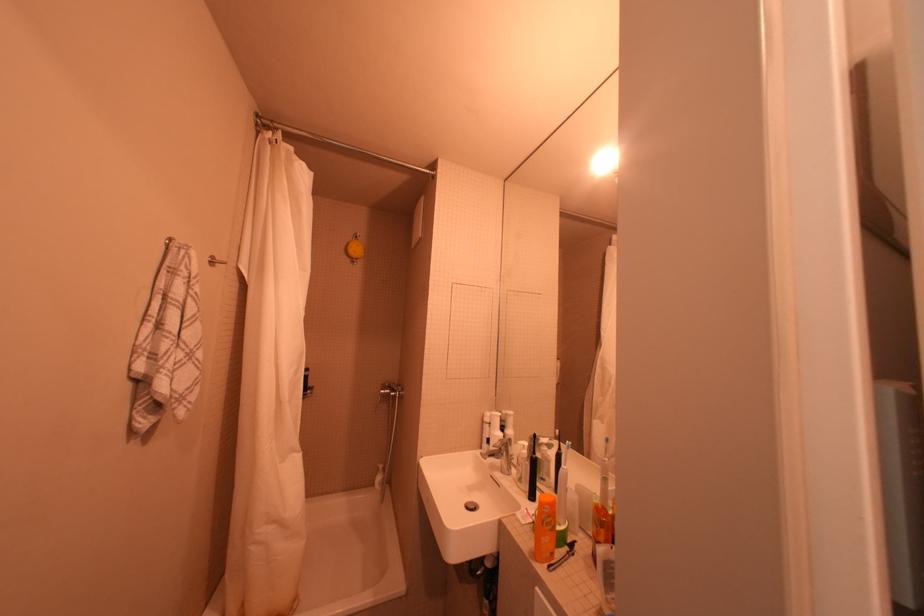
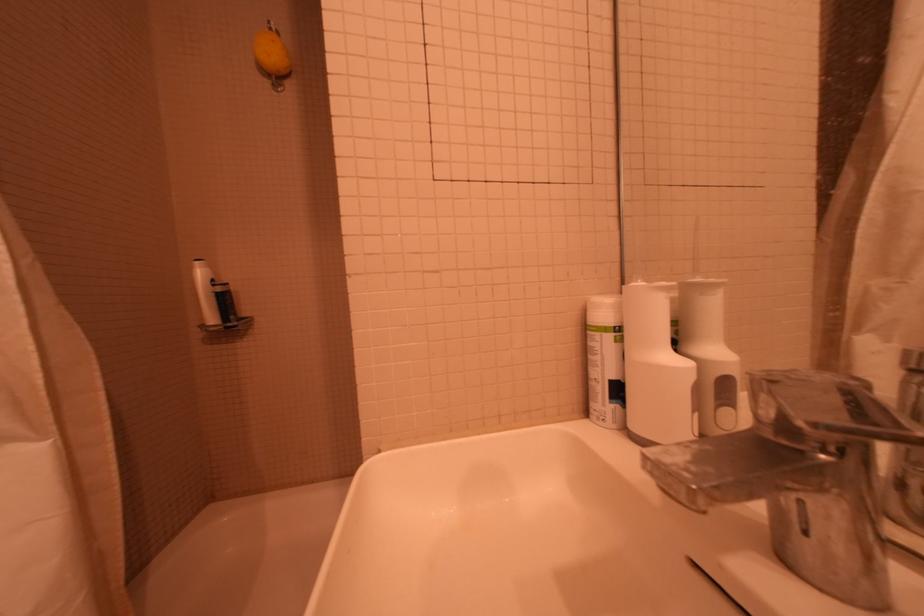
In the second image, find the point that corresponds to point 367,246 in the first image.

(281, 42)